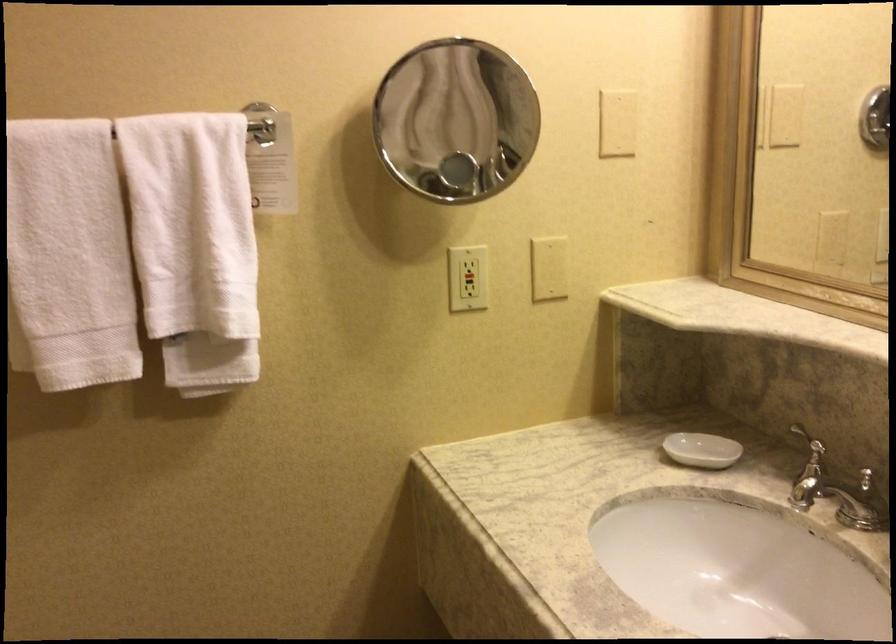
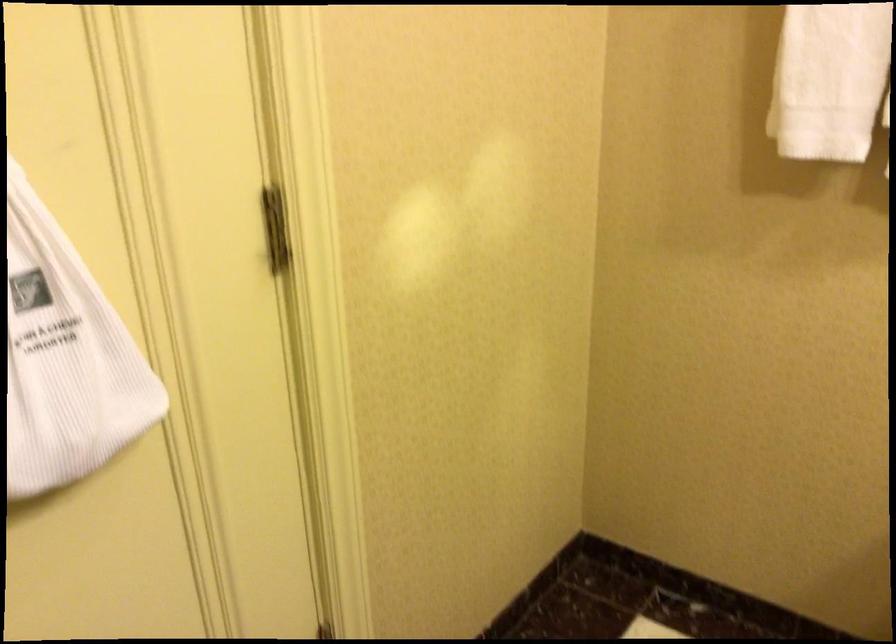
The first image is from the beginning of the video and the second image is from the end. How did the camera likely rotate when shooting the video?

The rotation direction of the camera is left-down.